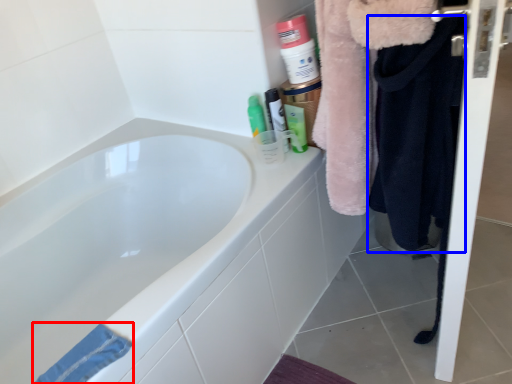
Question: Among these objects, which one is nearest to the camera, bath towel (highlighted by a red box) or clothing (highlighted by a blue box)?

Choices:
 (A) bath towel
 (B) clothing

Answer: (A)